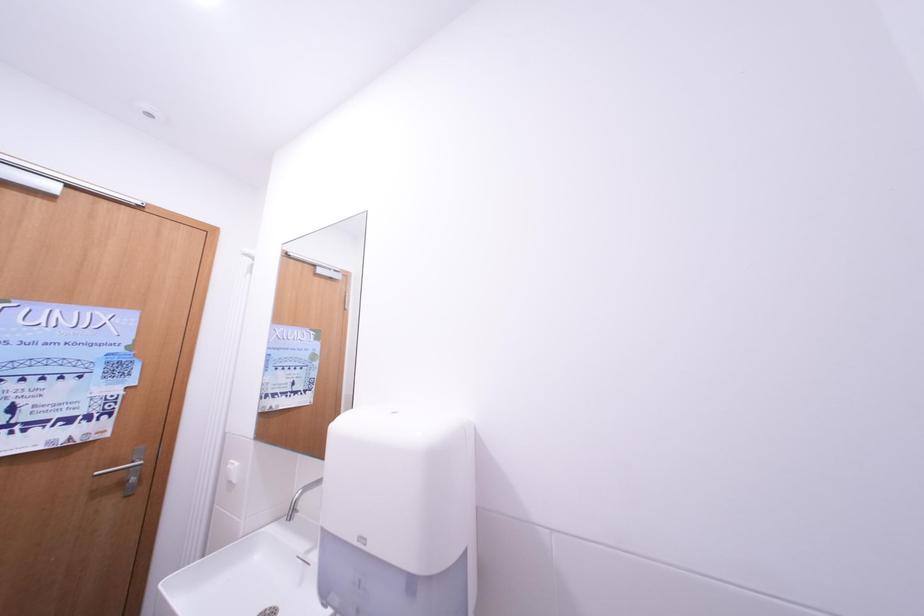
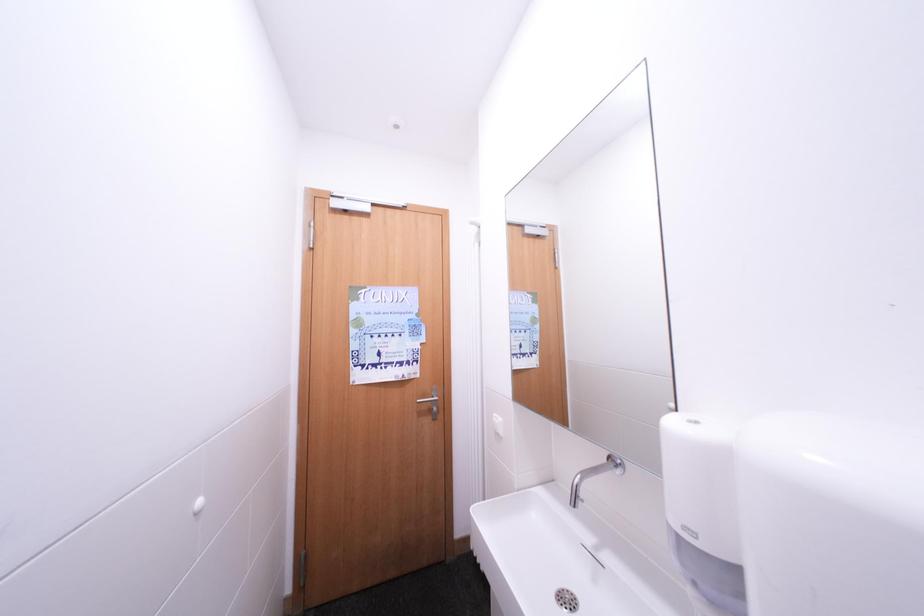
Question: The camera is either moving clockwise (left) or counter-clockwise (right) around the object. The first image is from the beginning of the video and the second image is from the end. Is the camera moving left or right when shooting the video?

Choices:
 (A) Left
 (B) Right

Answer: (B)